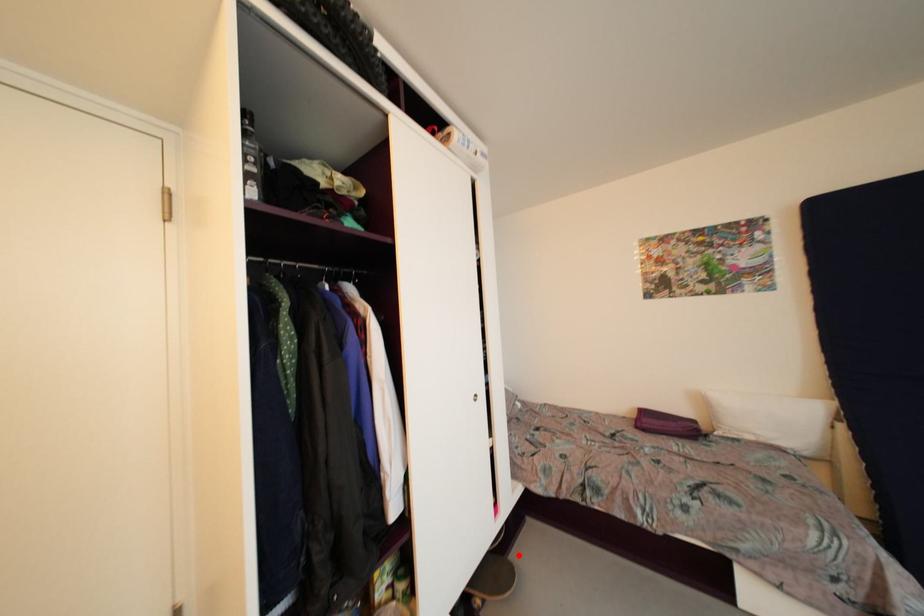
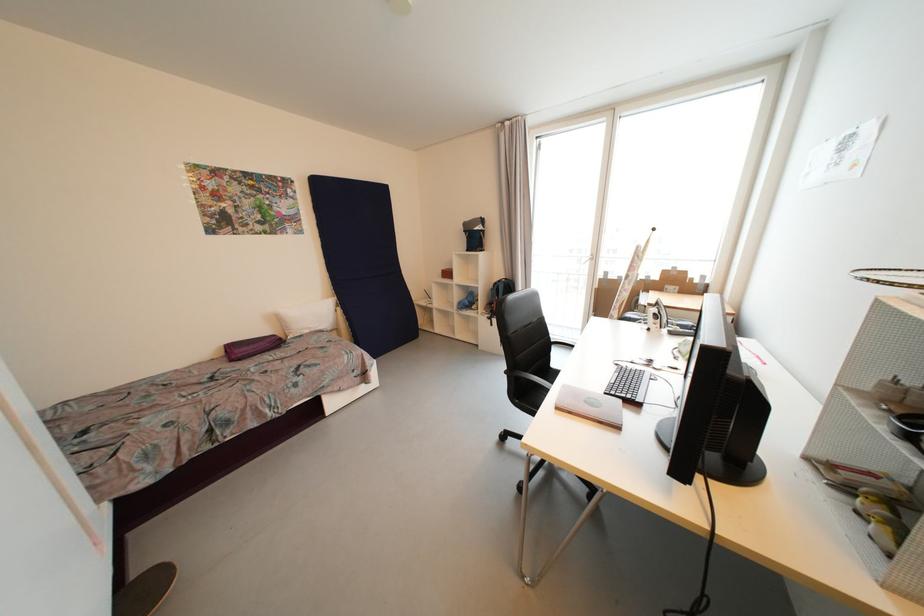
Question: I am providing you with two images of the same scene from different viewpoints. Image1 has a red point marked. In image2, the corresponding 3D location appears at what relative position? Reply with the corresponding letter.

Choices:
 (A) Closer
 (B) Farther

Answer: (B)